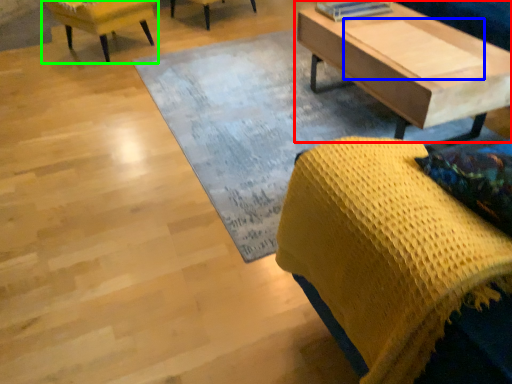
Question: Considering the real-world distances, which object is closest to coffee table (highlighted by a red box)? plank (highlighted by a blue box) or chair (highlighted by a green box).

Choices:
 (A) plank
 (B) chair

Answer: (A)